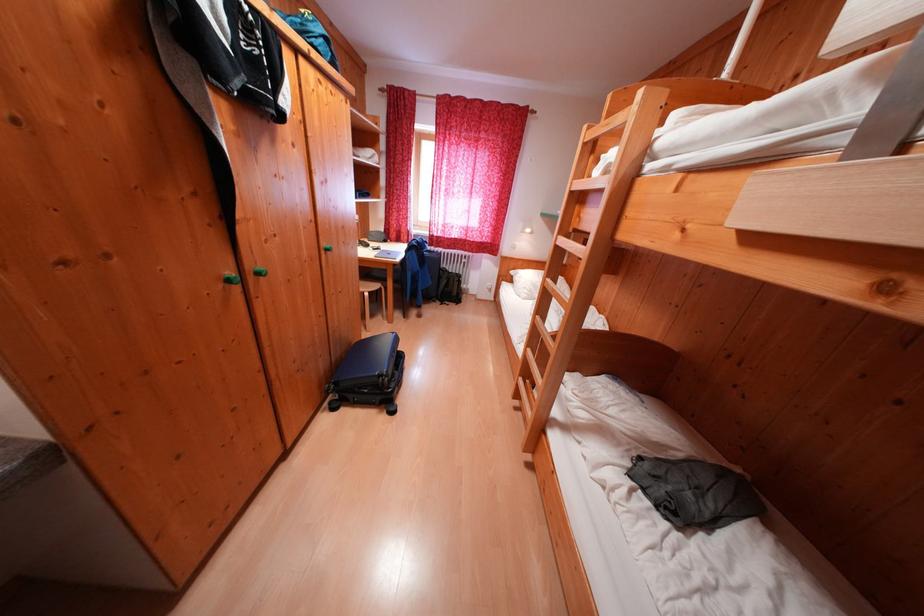
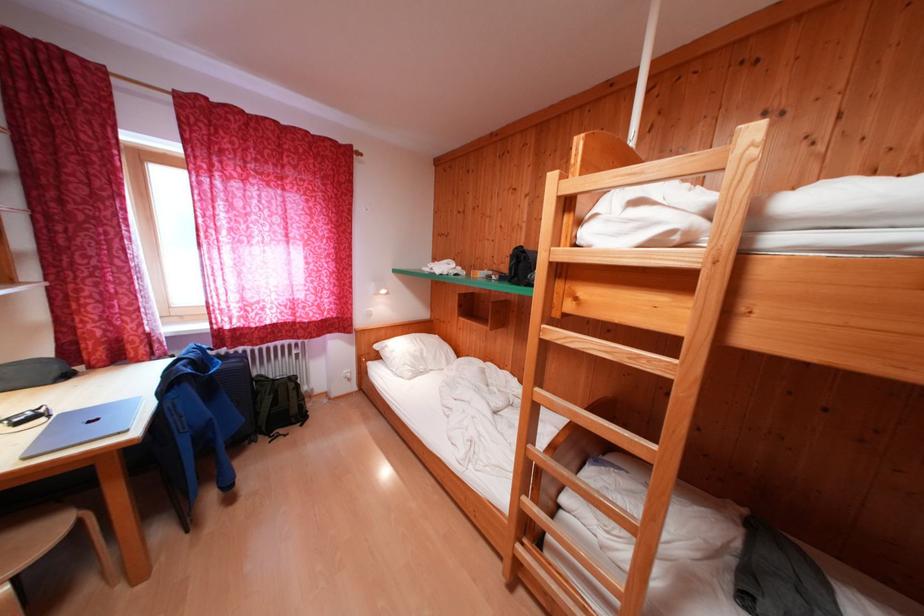
Where in the second image is the point corresponding to (x=383, y=290) from the first image?

(55, 538)